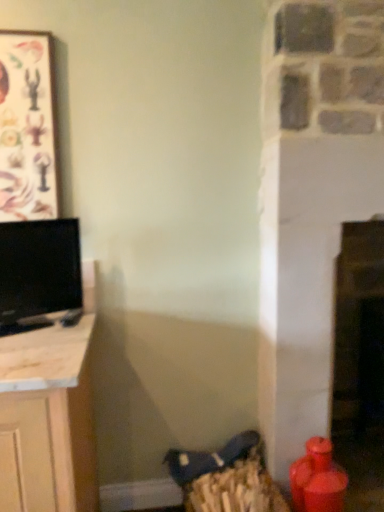
Question: From a real-world perspective, is black glossy tv at left on wooden frame at upper left?

Choices:
 (A) yes
 (B) no

Answer: (B)

Question: Is black glossy tv at left aimed at wooden frame at upper left?

Choices:
 (A) yes
 (B) no

Answer: (B)

Question: Is black glossy tv at left positioned beyond the bounds of wooden frame at upper left?

Choices:
 (A) yes
 (B) no

Answer: (A)

Question: From a real-world perspective, is black glossy tv at left beneath wooden frame at upper left?

Choices:
 (A) yes
 (B) no

Answer: (A)

Question: Considering the relative sizes of black glossy tv at left and wooden frame at upper left in the image provided, is black glossy tv at left thinner than wooden frame at upper left?

Choices:
 (A) no
 (B) yes

Answer: (A)

Question: Is black glossy tv at left positioned far away from wooden frame at upper left?

Choices:
 (A) no
 (B) yes

Answer: (A)

Question: Is wooden frame at upper left oriented away from black glossy tv at left?

Choices:
 (A) no
 (B) yes

Answer: (A)

Question: From the image's perspective, is wooden frame at upper left over black glossy tv at left?

Choices:
 (A) yes
 (B) no

Answer: (A)

Question: Can you confirm if wooden frame at upper left is bigger than black glossy tv at left?

Choices:
 (A) yes
 (B) no

Answer: (B)

Question: Is wooden frame at upper left to the left of black glossy tv at left from the viewer's perspective?

Choices:
 (A) yes
 (B) no

Answer: (A)

Question: Is wooden frame at upper left facing towards black glossy tv at left?

Choices:
 (A) yes
 (B) no

Answer: (B)

Question: Is wooden frame at upper left closer to camera compared to black glossy tv at left?

Choices:
 (A) yes
 (B) no

Answer: (B)

Question: In terms of height, does black glossy tv at left look taller or shorter compared to wooden frame at upper left?

Choices:
 (A) tall
 (B) short

Answer: (B)